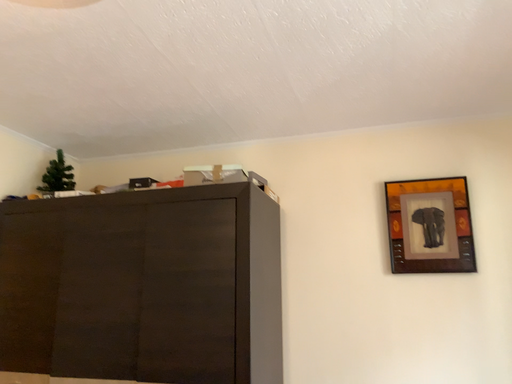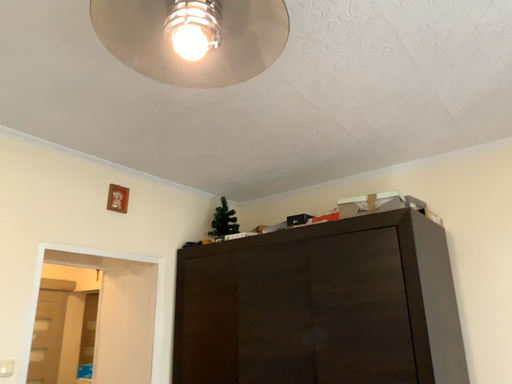
Question: How did the camera likely rotate when shooting the video?

Choices:
 (A) rotated right
 (B) rotated left

Answer: (B)